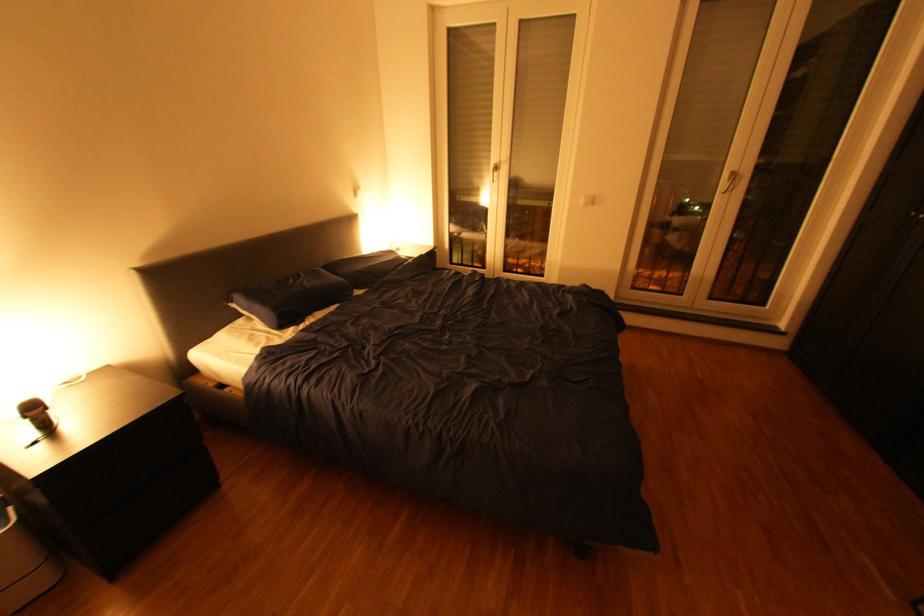
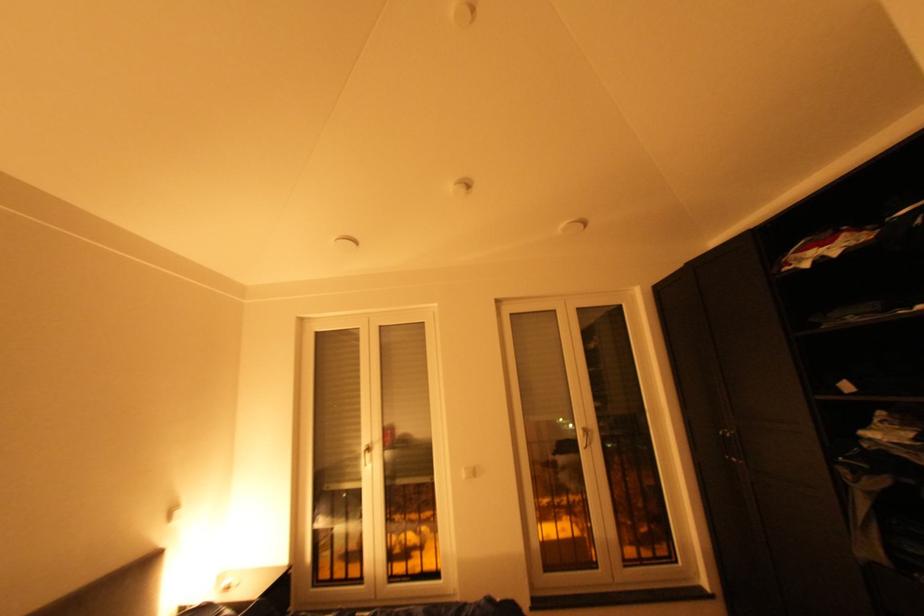
Find the pixel in the second image that matches (502,167) in the first image.

(372, 448)